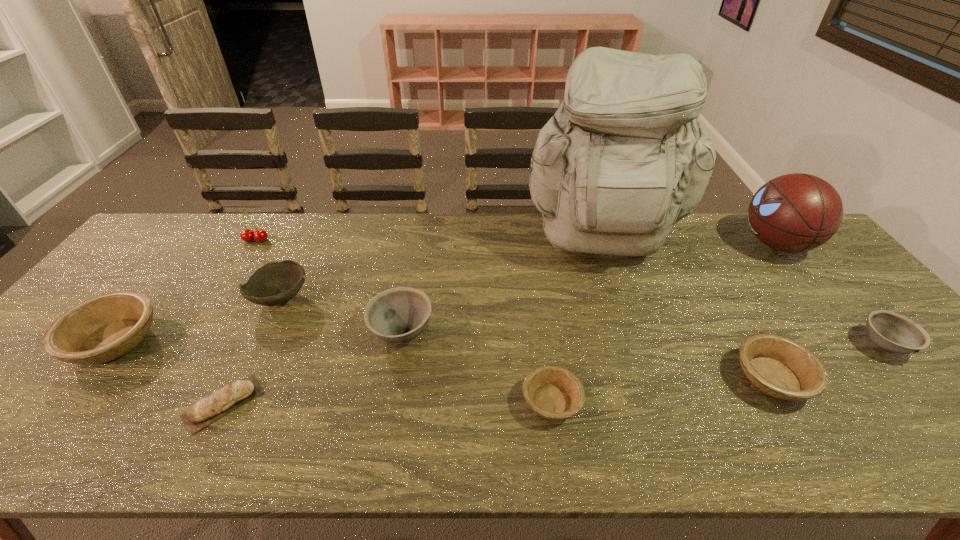
Locate an element on the screen. This screenshot has width=960, height=540. vacant point located on the front of the second bowl from left to right is located at coordinates (211, 446).

Locate an element on the screen. The image size is (960, 540). vacant region located on the right of the leftmost bowl is located at coordinates (239, 342).

Where is `free space located on the left of the smaller gray bowl`? The width and height of the screenshot is (960, 540). free space located on the left of the smaller gray bowl is located at coordinates (827, 345).

At what (x,y) coordinates should I click in order to perform the action: click on vacant space located on the left of the rightmost beige bowl. Please return your answer as a coordinate pair (x, y). Looking at the image, I should click on (567, 379).

This screenshot has width=960, height=540. I want to click on vacant space located 0.330m on the right of the second beige bowl from left to right, so click(x=730, y=402).

Where is `free spot located on the right of the pita bread`? The height and width of the screenshot is (540, 960). free spot located on the right of the pita bread is located at coordinates (399, 404).

Identify the location of backpack located at the far edge. (623, 159).

This screenshot has height=540, width=960. Find the location of `basketball that is positioned at the far edge`. basketball that is positioned at the far edge is located at coordinates (797, 212).

Identify the location of cherry located in the far edge section of the desktop. tap(247, 235).

This screenshot has width=960, height=540. I want to click on bowl situated at the near edge, so click(555, 393).